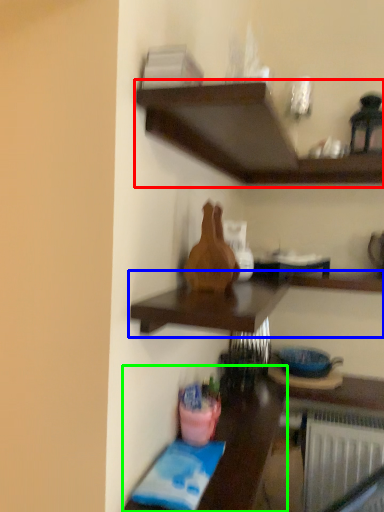
Question: Based on their relative distances, which object is farther from shelf (highlighted by a red box)? Choose from shelf (highlighted by a blue box) and table (highlighted by a green box).

Choices:
 (A) shelf
 (B) table

Answer: (B)